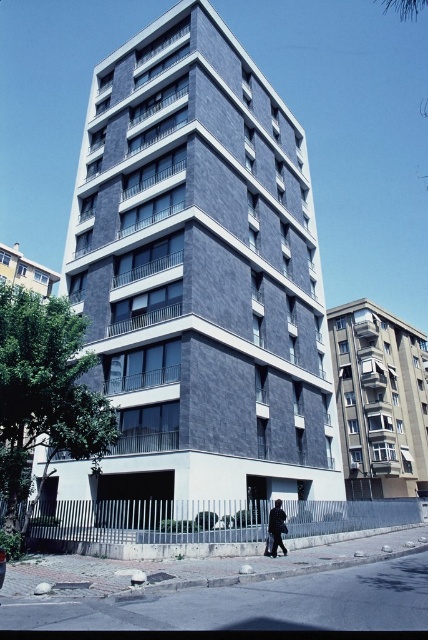
Question: Which is nearer to the dark blue jacket at lower center?

Choices:
 (A) matte gray building at upper left
 (B) dark gray stone building at center
 (C) dark gray stone building at right

Answer: (B)

Question: Is matte gray building at upper left bigger than dark blue jacket at lower center?

Choices:
 (A) no
 (B) yes

Answer: (B)

Question: Is matte gray building at upper left positioned at the back of dark blue jacket at lower center?

Choices:
 (A) yes
 (B) no

Answer: (A)

Question: Among these points, which one is nearest to the camera?

Choices:
 (A) (419, 410)
 (B) (181, 99)
 (C) (275, 504)
 (D) (48, 276)

Answer: (C)

Question: Can you confirm if dark gray stone building at right is positioned to the left of matte gray building at upper left?

Choices:
 (A) no
 (B) yes

Answer: (A)

Question: Which point appears farthest from the camera in this image?

Choices:
 (A) (347, 412)
 (B) (133, 230)
 (C) (273, 538)

Answer: (A)